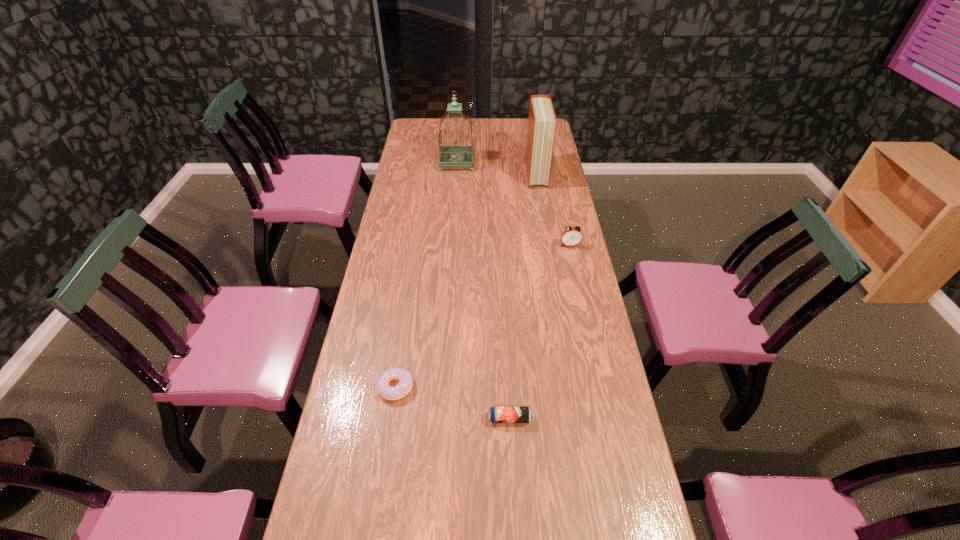
I want to click on free spot that satisfies the following two spatial constraints: 1. on the front side of the second nearest object; 2. on the right side of the nearest object, so click(x=391, y=419).